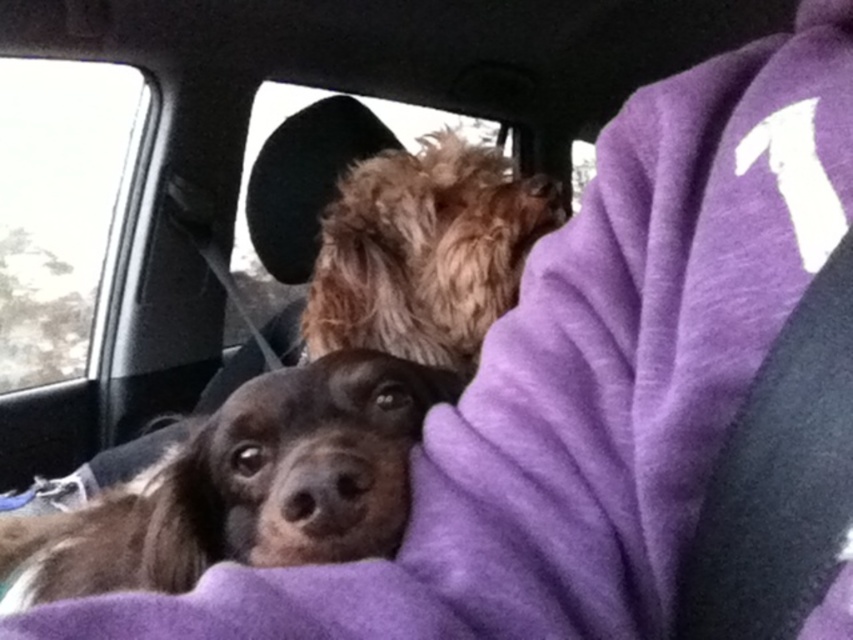
Question: Is brown fur dog at center to the right of transparent glass at upper left from the viewer's perspective?

Choices:
 (A) no
 (B) yes

Answer: (B)

Question: Is brown fur dog at center in front of transparent glass at upper left?

Choices:
 (A) no
 (B) yes

Answer: (B)

Question: Which of these objects is positioned farthest from the transparent glass at upper left?

Choices:
 (A) brown fur dog at center
 (B) fuzzy brown dog at upper center

Answer: (A)

Question: Is brown fur dog at center wider than transparent glass at upper left?

Choices:
 (A) yes
 (B) no

Answer: (A)

Question: Which of the following is the closest to the observer?

Choices:
 (A) fuzzy brown dog at upper center
 (B) transparent glass at upper left
 (C) brown fur dog at center

Answer: (C)

Question: Which point is farther to the camera?

Choices:
 (A) (39, 132)
 (B) (512, 273)

Answer: (A)